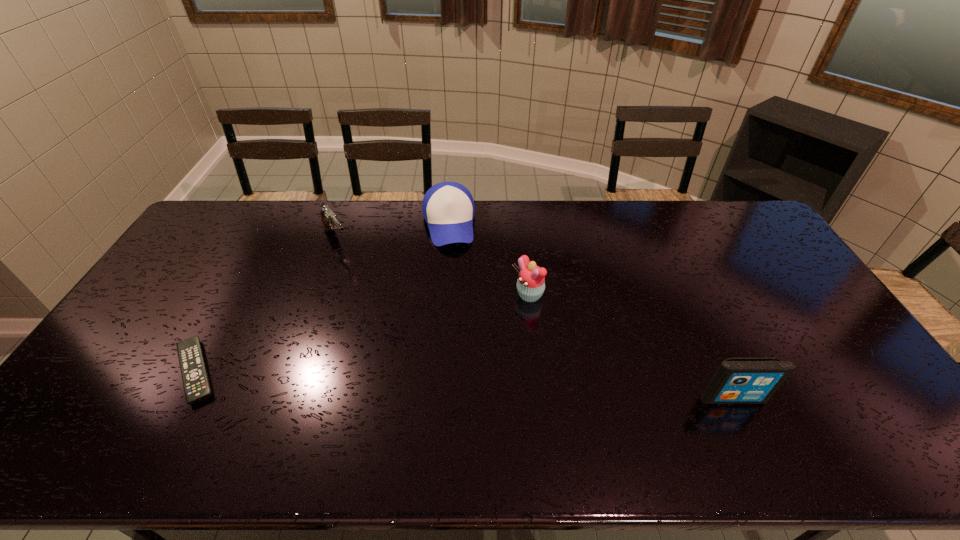
This screenshot has height=540, width=960. In order to click on free spot that satisfies the following two spatial constraints: 1. on the back side of the leftmost object; 2. on the right side of the fourth object from right to left in this screenshot , I will do `click(267, 240)`.

Find the location of a particular element. free spot that satisfies the following two spatial constraints: 1. on the back side of the fourth object from left to right; 2. on the left side of the shortest object is located at coordinates (236, 296).

At what (x,y) coordinates should I click in order to perform the action: click on free point that satisfies the following two spatial constraints: 1. on the front side of the third object from right to left; 2. on the right side of the third nearest object. Please return your answer as a coordinate pair (x, y). The image size is (960, 540). Looking at the image, I should click on (442, 296).